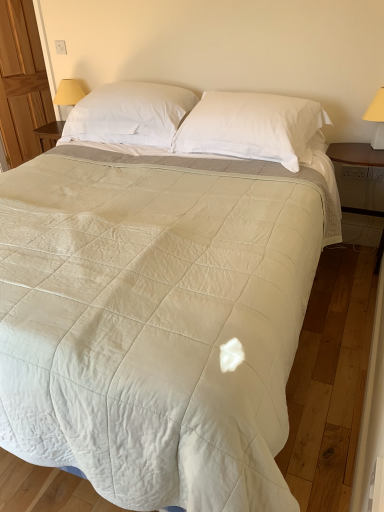
The width and height of the screenshot is (384, 512). Describe the element at coordinates (68, 93) in the screenshot. I see `yellow fabric lampshade at upper left, which is the second table lamp from right to left` at that location.

What is the approximate width of white soft pillow at upper center, which is the second pillow in right-to-left order?

49.20 centimeters.

The width and height of the screenshot is (384, 512). In order to click on white soft pillow at center, placed as the first pillow when sorted from right to left in this screenshot , I will do `click(253, 128)`.

The height and width of the screenshot is (512, 384). Describe the element at coordinates (377, 119) in the screenshot. I see `yellow fabric lampshade at right, which is the second table lamp from back to front` at that location.

I want to click on wooden armoire at left, so click(22, 82).

This screenshot has width=384, height=512. In order to click on yellow fabric lampshade at upper left, the first table lamp positioned from the top in this screenshot , I will do `click(68, 93)`.

How many degrees apart are the facing directions of wooden armoire at left and white soft pillow at upper center, which is the first pillow from left to right?

They differ by 69.8 degrees in their facing directions.

Is wooden armoire at left in front of or behind white soft pillow at upper center, which is the second pillow in right-to-left order, in the image?

wooden armoire at left is behind white soft pillow at upper center, which is the second pillow in right-to-left order.

From the image's perspective, is wooden armoire at left above white soft pillow at upper center, which is the second pillow in right-to-left order?

Indeed, from the image's perspective, wooden armoire at left is shown above white soft pillow at upper center, which is the second pillow in right-to-left order.

Would you consider white soft pillow at upper center, which is the first pillow from left to right, to be distant from wooden armoire at left?

Yes, white soft pillow at upper center, which is the first pillow from left to right, and wooden armoire at left are located far from each other.

Can you confirm if white soft pillow at upper center, which is the first pillow from left to right, is positioned to the right of wooden armoire at left?

Yes.

Can you confirm if white soft pillow at upper center, which is the second pillow in right-to-left order, is thinner than wooden armoire at left?

No, white soft pillow at upper center, which is the second pillow in right-to-left order, is not thinner than wooden armoire at left.

Is point (154, 109) closer to camera compared to point (12, 167)?

Yes, point (154, 109) is closer to viewer.

Is white soft pillow at center, placed as the first pillow when sorted from right to left, beside yellow fabric lampshade at right, positioned as the first table lamp in front-to-back order?

No, white soft pillow at center, placed as the first pillow when sorted from right to left, is not in contact with yellow fabric lampshade at right, positioned as the first table lamp in front-to-back order.

Can you tell me how much white soft pillow at center, placed as the first pillow when sorted from right to left, and yellow fabric lampshade at right, marked as the 2th table lamp in a left-to-right arrangement, differ in facing direction?

There is a 2.4-degree angle between the facing directions of white soft pillow at center, placed as the first pillow when sorted from right to left, and yellow fabric lampshade at right, marked as the 2th table lamp in a left-to-right arrangement.

In the image, is white soft pillow at center, placed as the first pillow when sorted from right to left, positioned in front of or behind yellow fabric lampshade at right, marked as the 2th table lamp in a left-to-right arrangement?

white soft pillow at center, placed as the first pillow when sorted from right to left, is positioned closer to the viewer than yellow fabric lampshade at right, marked as the 2th table lamp in a left-to-right arrangement.

From the image's perspective, is white soft pillow at center, the second pillow positioned from the left, beneath yellow fabric lampshade at right, which appears as the 2th table lamp when viewed from the top?

Yes.

Which object is further away from the camera taking this photo, yellow fabric lampshade at right, positioned as the first table lamp in front-to-back order, or white soft pillow at center, placed as the first pillow when sorted from right to left?

yellow fabric lampshade at right, positioned as the first table lamp in front-to-back order, is more distant.

From the image's perspective, is yellow fabric lampshade at right, marked as the 2th table lamp in a left-to-right arrangement, located above white soft pillow at center, placed as the first pillow when sorted from right to left?

Correct, yellow fabric lampshade at right, marked as the 2th table lamp in a left-to-right arrangement, appears higher than white soft pillow at center, placed as the first pillow when sorted from right to left, in the image.

Could you tell me if yellow fabric lampshade at right, which ranks as the 1th table lamp in right-to-left order, is turned towards white soft pillow at center, the second pillow positioned from the left?

No, yellow fabric lampshade at right, which ranks as the 1th table lamp in right-to-left order, does not turn towards white soft pillow at center, the second pillow positioned from the left.

From the image's perspective, which one is positioned lower, wooden armoire at left or yellow fabric lampshade at upper left, positioned as the first table lamp in left-to-right order?

yellow fabric lampshade at upper left, positioned as the first table lamp in left-to-right order, from the image's perspective.

Consider the image. Can you confirm if wooden armoire at left is taller than yellow fabric lampshade at upper left, positioned as the first table lamp in left-to-right order?

Yes, wooden armoire at left is taller than yellow fabric lampshade at upper left, positioned as the first table lamp in left-to-right order.

In the scene shown: Choose the correct answer: Is wooden armoire at left inside yellow fabric lampshade at upper left, the 2th table lamp in the front-to-back sequence, or outside it?

The correct answer is: outside.

Considering the points (138, 89) and (299, 162), which point is in front, point (138, 89) or point (299, 162)?

The point (299, 162) is closer to the camera.

From a real-world perspective, is white soft pillow at upper center, which is the first pillow from left to right, physically above white soft pillow at center, placed as the first pillow when sorted from right to left?

Yes.

Considering the sizes of objects white soft pillow at upper center, which is the second pillow in right-to-left order, and white soft pillow at center, placed as the first pillow when sorted from right to left, in the image provided, who is shorter, white soft pillow at upper center, which is the second pillow in right-to-left order, or white soft pillow at center, placed as the first pillow when sorted from right to left,?

With less height is white soft pillow at center, placed as the first pillow when sorted from right to left.

Considering the sizes of objects white soft pillow at upper center, which is the second pillow in right-to-left order, and white soft pillow at center, the second pillow positioned from the left, in the image provided, who is smaller, white soft pillow at upper center, which is the second pillow in right-to-left order, or white soft pillow at center, the second pillow positioned from the left,?

white soft pillow at center, the second pillow positioned from the left, is smaller.

Relative to white soft pillow at upper center, which is the first pillow from left to right, is white soft pillow at center, the second pillow positioned from the left, in front or behind?

Visually, white soft pillow at center, the second pillow positioned from the left, is located in front of white soft pillow at upper center, which is the first pillow from left to right.

From a real-world perspective, is white soft pillow at center, placed as the first pillow when sorted from right to left, under white soft pillow at upper center, which is the first pillow from left to right?

Yes, from a real-world perspective, white soft pillow at center, placed as the first pillow when sorted from right to left, is beneath white soft pillow at upper center, which is the first pillow from left to right.

Is white soft pillow at center, placed as the first pillow when sorted from right to left, smaller than white soft pillow at upper center, which is the first pillow from left to right?

Yes, white soft pillow at center, placed as the first pillow when sorted from right to left, is smaller than white soft pillow at upper center, which is the first pillow from left to right.

Considering the sizes of objects white soft pillow at center, the second pillow positioned from the left, and white soft pillow at upper center, which is the first pillow from left to right, in the image provided, who is wider, white soft pillow at center, the second pillow positioned from the left, or white soft pillow at upper center, which is the first pillow from left to right,?

Wider between the two is white soft pillow at upper center, which is the first pillow from left to right.

Image resolution: width=384 pixels, height=512 pixels. I want to click on the 1st pillow in front of the wooden armoire at left, counting from the anchor's position, so click(129, 114).

The width and height of the screenshot is (384, 512). Identify the location of armoire lying above the white soft pillow at upper center, which is the second pillow in right-to-left order (from the image's perspective). (22, 82).

Which object lies nearer to the anchor point wooden armoire at left, white soft pillow at upper center, which is the first pillow from left to right, or yellow fabric lampshade at right, which ranks as the 1th table lamp in right-to-left order?

white soft pillow at upper center, which is the first pillow from left to right, is closer to wooden armoire at left.

Estimate the real-world distances between objects in this image. Which object is closer to white soft pillow at center, placed as the first pillow when sorted from right to left, yellow fabric lampshade at right, positioned as the first table lamp in front-to-back order, or wooden armoire at left?

yellow fabric lampshade at right, positioned as the first table lamp in front-to-back order, is closer to white soft pillow at center, placed as the first pillow when sorted from right to left.

When comparing their distances from yellow fabric lampshade at right, which ranks as the 1th table lamp in right-to-left order, does white soft pillow at center, placed as the first pillow when sorted from right to left, or wooden armoire at left seem further?

wooden armoire at left is positioned further to the anchor yellow fabric lampshade at right, which ranks as the 1th table lamp in right-to-left order.

Which object lies nearer to the anchor point yellow fabric lampshade at right, which ranks as the 1th table lamp in right-to-left order, white soft pillow at center, the second pillow positioned from the left, or white soft pillow at upper center, which is the second pillow in right-to-left order?

Among the two, white soft pillow at center, the second pillow positioned from the left, is located nearer to yellow fabric lampshade at right, which ranks as the 1th table lamp in right-to-left order.

Considering their positions, is yellow fabric lampshade at upper left, which is the 2th table lamp in bottom-to-top order, positioned closer to wooden armoire at left than yellow fabric lampshade at right, marked as the 2th table lamp in a left-to-right arrangement?

yellow fabric lampshade at upper left, which is the 2th table lamp in bottom-to-top order.

Looking at the image, which one is located further to wooden armoire at left, yellow fabric lampshade at right, which is the second table lamp from back to front, or white soft pillow at upper center, which is the first pillow from left to right?

yellow fabric lampshade at right, which is the second table lamp from back to front, is further to wooden armoire at left.

Which object lies nearer to the anchor point white soft pillow at upper center, which is the second pillow in right-to-left order, wooden armoire at left or yellow fabric lampshade at upper left, which is the 2th table lamp in bottom-to-top order?

The object closer to white soft pillow at upper center, which is the second pillow in right-to-left order, is yellow fabric lampshade at upper left, which is the 2th table lamp in bottom-to-top order.

From the picture: Which object lies further to the anchor point wooden armoire at left, white soft pillow at center, placed as the first pillow when sorted from right to left, or yellow fabric lampshade at upper left, which is the second table lamp from right to left?

white soft pillow at center, placed as the first pillow when sorted from right to left, lies further to wooden armoire at left than the other object.

I want to click on pillow situated between white soft pillow at upper center, which is the first pillow from left to right, and yellow fabric lampshade at right, marked as the 2th table lamp in a left-to-right arrangement, from left to right, so click(x=253, y=128).

Where is `pillow between wooden armoire at left and white soft pillow at center, placed as the first pillow when sorted from right to left, in the horizontal direction`? pillow between wooden armoire at left and white soft pillow at center, placed as the first pillow when sorted from right to left, in the horizontal direction is located at coordinates (129, 114).

Where is `table lamp between wooden armoire at left and white soft pillow at upper center, which is the first pillow from left to right, in the horizontal direction`? table lamp between wooden armoire at left and white soft pillow at upper center, which is the first pillow from left to right, in the horizontal direction is located at coordinates (68, 93).

The height and width of the screenshot is (512, 384). Find the location of `table lamp situated between wooden armoire at left and white soft pillow at center, placed as the first pillow when sorted from right to left, from left to right`. table lamp situated between wooden armoire at left and white soft pillow at center, placed as the first pillow when sorted from right to left, from left to right is located at coordinates (68, 93).